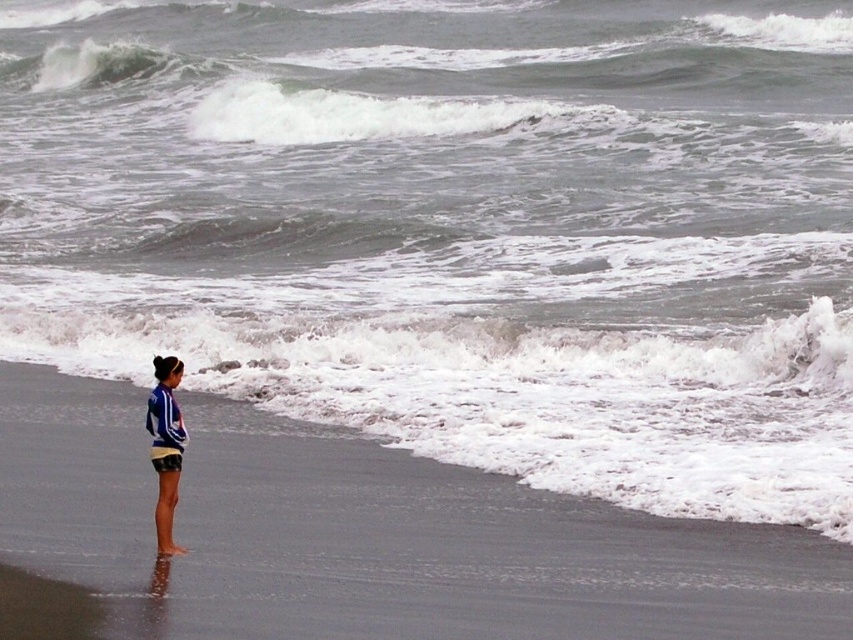
Which is in front, point (416, 468) or point (177, 474)?

Point (177, 474)

Can you confirm if smooth sand beach at lower left is positioned above blue striped shirt at lower left?

No, smooth sand beach at lower left is not above blue striped shirt at lower left.

Does point (685, 616) come farther from viewer compared to point (157, 444)?

That is False.

Where is `smooth sand beach at lower left`? The height and width of the screenshot is (640, 853). smooth sand beach at lower left is located at coordinates (372, 536).